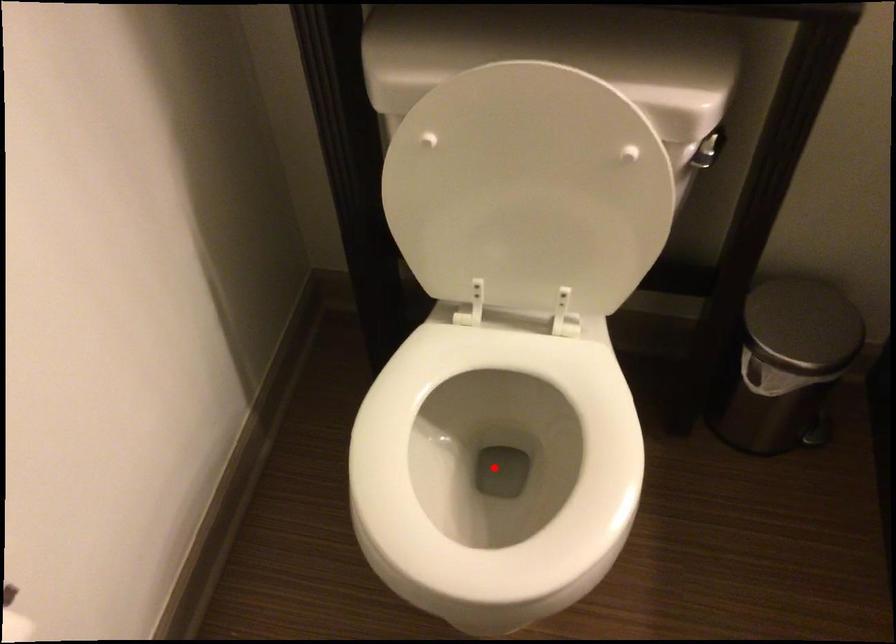
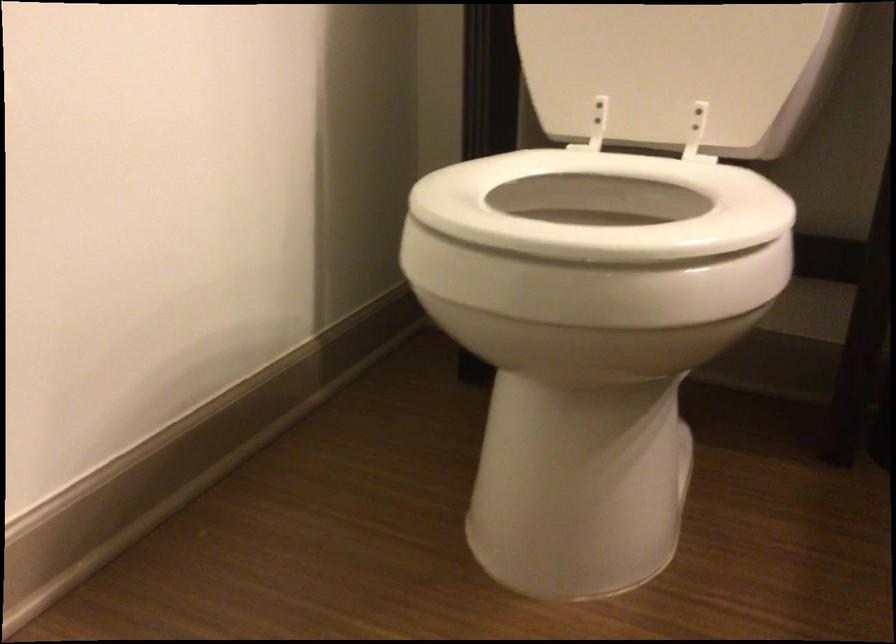
Question: I am providing you with two images of the same scene from different viewpoints. A red point is marked on the first image. Can you still see the location of the red point in image 2?

Choices:
 (A) Yes
 (B) No

Answer: (B)